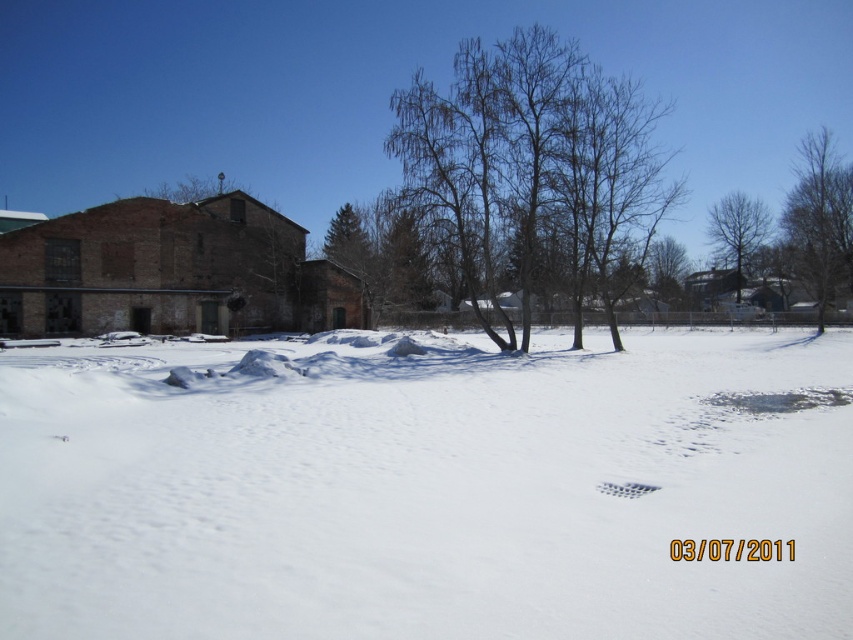
Question: Which point is farther from the camera taking this photo?

Choices:
 (A) (599, 492)
 (B) (743, 262)
 (C) (827, 300)
 (D) (821, 362)

Answer: (B)

Question: Does bare branches at center have a greater width compared to bare branches at upper right?

Choices:
 (A) yes
 (B) no

Answer: (A)

Question: Which of these objects is positioned farthest from the white plastic footprint at center?

Choices:
 (A) bare branches at center
 (B) bare branches at upper right

Answer: (B)

Question: Can you confirm if white powdery snow at center is bigger than bare brown tree at upper right?

Choices:
 (A) no
 (B) yes

Answer: (A)

Question: Does bare branches at center appear on the right side of bare branches at upper right?

Choices:
 (A) yes
 (B) no

Answer: (B)

Question: Which object appears closest to the camera in this image?

Choices:
 (A) white powdery snow at center
 (B) bare branches at center
 (C) brown textured tree at center

Answer: (A)